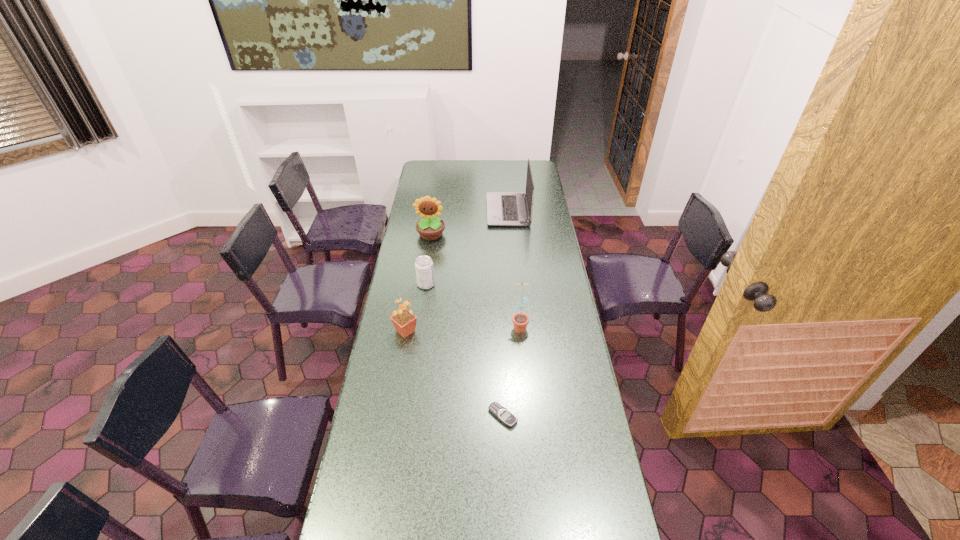
Locate an element on the screen. vacant space that satisfies the following two spatial constraints: 1. on the face of the second shortest object; 2. on the left side of the farthest sunflower is located at coordinates (423, 285).